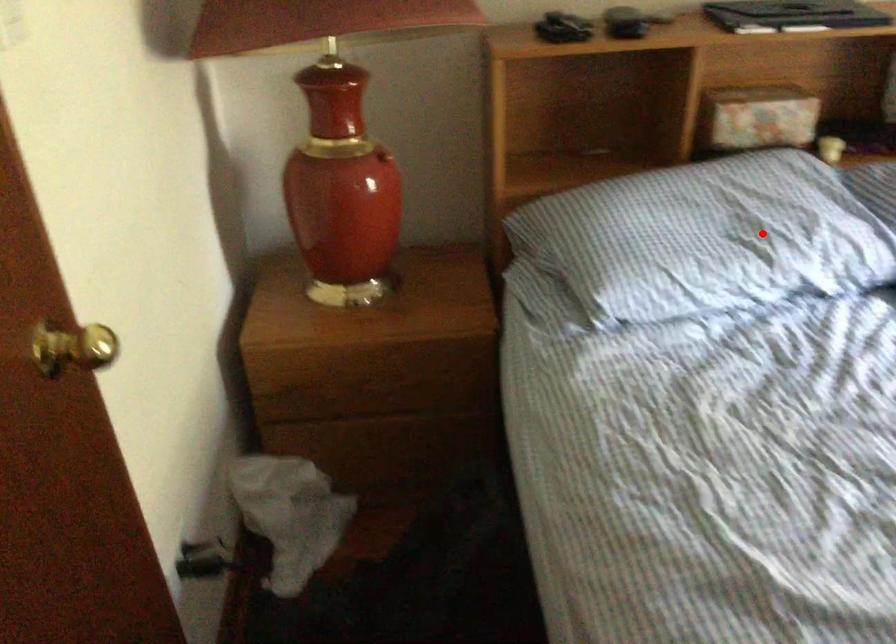
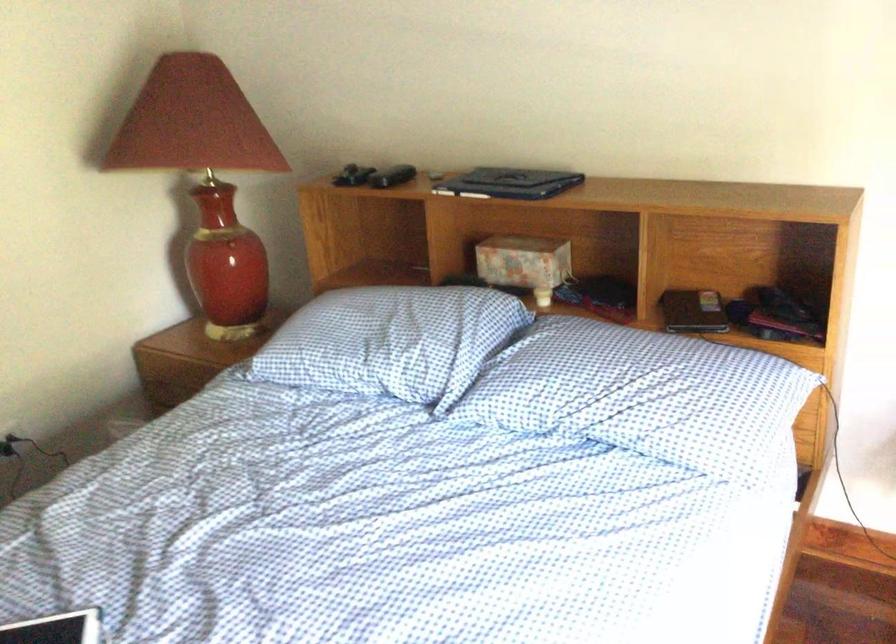
Question: A red point is marked in image1. In image2, is the corresponding 3D point closer to the camera or farther? Reply with the corresponding letter.

Choices:
 (A) The corresponding 3D point is closer.
 (B) The corresponding 3D point is farther.

Answer: (B)